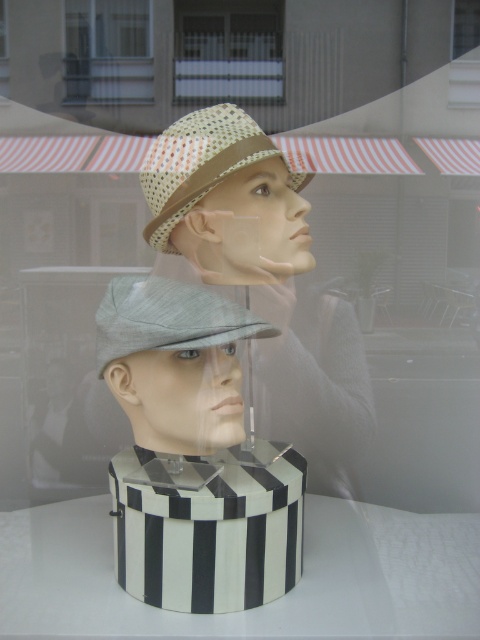
Which is more to the left, black and white striped hat at center or black and white striped box at center?

From the viewer's perspective, black and white striped hat at center appears more on the left side.

Which is more to the right, black and white striped hat at center or black and white striped box at center?

From the viewer's perspective, black and white striped box at center appears more on the right side.

Is point (192, 452) closer to viewer compared to point (268, 598)?

No, (192, 452) is behind (268, 598).

Identify the location of black and white striped hat at center. (193, 452).

Is matte straw hat at center smaller than woven straw hat at center?

Actually, matte straw hat at center might be larger than woven straw hat at center.

Looking at this image, is matte straw hat at center thinner than woven straw hat at center?

No.

The width and height of the screenshot is (480, 640). In order to click on matte straw hat at center in this screenshot , I will do `click(263, 280)`.

Image resolution: width=480 pixels, height=640 pixels. I want to click on matte straw hat at center, so click(263, 280).

In the scene shown: Does white mesh fence at upper center lie behind clear glass window at upper center?

That is False.

Which of these two, white mesh fence at upper center or clear glass window at upper center, stands shorter?

With less height is white mesh fence at upper center.

Does point (182, 4) come in front of point (115, 42)?

Yes, point (182, 4) is in front of point (115, 42).

You are a GUI agent. You are given a task and a screenshot of the screen. Output one action in this format:
    pyautogui.click(x=<x>, y=<y>)
    Task: Click on the white mesh fence at upper center
    Image resolution: width=480 pixels, height=640 pixels.
    Given the screenshot: What is the action you would take?
    pyautogui.click(x=228, y=51)